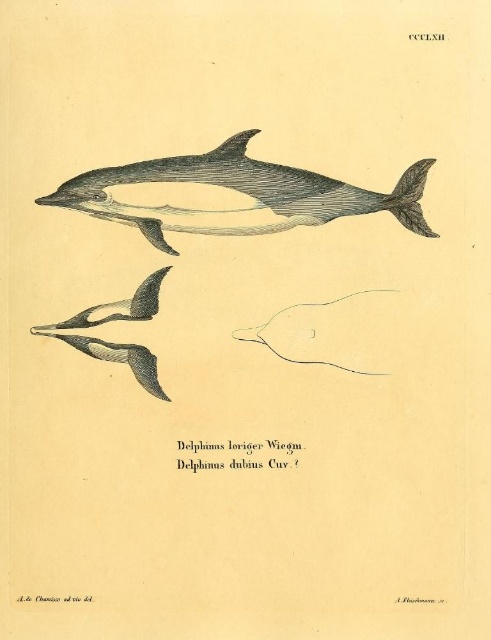
Can you confirm if gray textured dolphin at lower left is positioned above gray matte dolphin fin at lower left?

Incorrect, gray textured dolphin at lower left is not positioned above gray matte dolphin fin at lower left.

Is gray textured dolphin at lower left wider than gray matte dolphin fin at lower left?

In fact, gray textured dolphin at lower left might be narrower than gray matte dolphin fin at lower left.

Locate an element on the screen. gray textured dolphin at lower left is located at coordinates (116, 356).

Is gray ink dolphin at center bigger than gray textured dolphin at lower left?

Yes, gray ink dolphin at center is bigger than gray textured dolphin at lower left.

Which of these two, gray ink dolphin at center or gray textured dolphin at lower left, stands taller?

gray ink dolphin at center is taller.

Measure the distance between point (202,177) and camera.

Point (202,177) is 1.38 meters from camera.

The width and height of the screenshot is (491, 640). In order to click on gray ink dolphin at center in this screenshot , I will do `click(242, 193)`.

Can you confirm if gray ink dolphin at center is shorter than gray matte dolphin fin at lower left?

Incorrect, gray ink dolphin at center's height does not fall short of gray matte dolphin fin at lower left's.

Where is `gray ink dolphin at center`? gray ink dolphin at center is located at coordinates (242, 193).

Between point (392, 195) and point (151, 292), which one is positioned behind?

The point (151, 292) is more distant.

The width and height of the screenshot is (491, 640). Identify the location of gray ink dolphin at center. (242, 193).